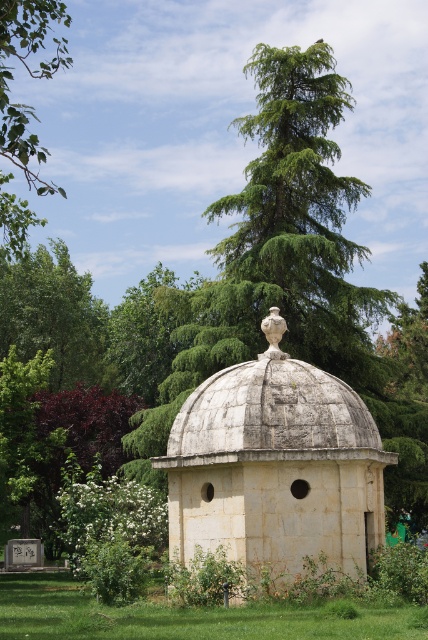
Question: Which object is the farthest from the green leafy tree at center?

Choices:
 (A) green grass at lower center
 (B) white stone gazebo at center
 (C) green leafy branch at upper left

Answer: (A)

Question: Among these objects, which one is nearest to the camera?

Choices:
 (A) green grass at lower center
 (B) white stone gazebo at center

Answer: (A)

Question: Is white stone gazebo at center behind green leafy branch at upper left?

Choices:
 (A) no
 (B) yes

Answer: (B)

Question: Observing the image, what is the correct spatial positioning of green leafy tree at center in reference to green grass at lower center?

Choices:
 (A) below
 (B) above

Answer: (B)

Question: Is green leafy tree at center bigger than green grass at lower center?

Choices:
 (A) yes
 (B) no

Answer: (A)

Question: Which point is closer to the camera?

Choices:
 (A) white stone gazebo at center
 (B) green leafy tree at center
 (C) green leafy branch at upper left

Answer: (C)